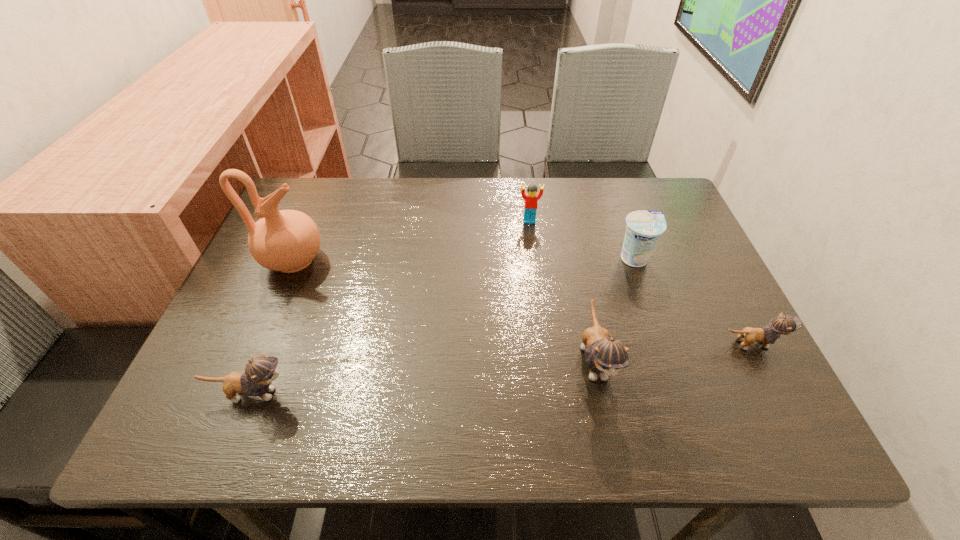
This screenshot has height=540, width=960. I want to click on free space that satisfies the following two spatial constraints: 1. on the face of the third object from left to right; 2. on the front-facing side of the leftmost kitten, so click(551, 394).